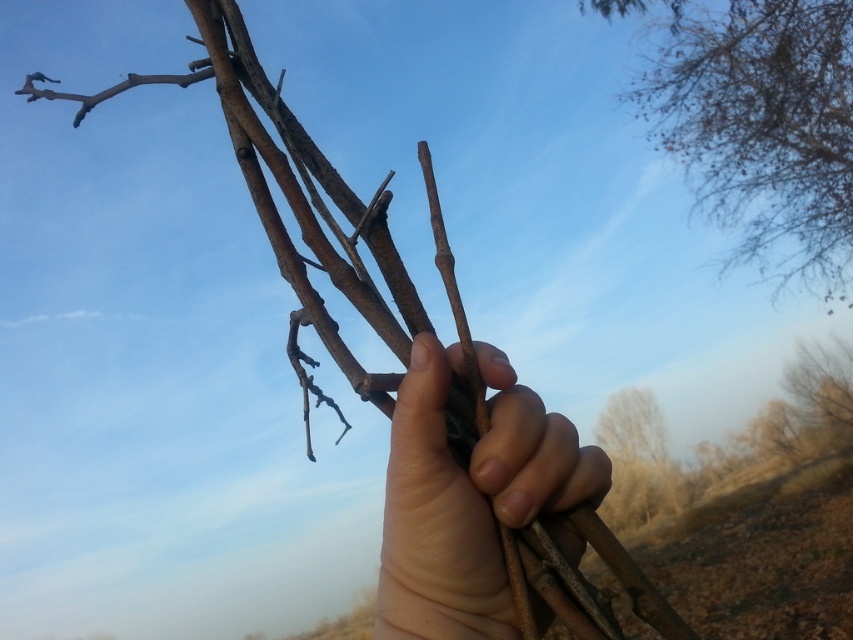
Question: Which point is closer to the camera taking this photo?

Choices:
 (A) (810, 70)
 (B) (611, 513)

Answer: (A)

Question: Where is smooth brown hand at center located in relation to brown rough tree at lower right in the image?

Choices:
 (A) above
 (B) below

Answer: (A)

Question: Which of the following is the farthest from the observer?

Choices:
 (A) (849, 51)
 (B) (606, 438)
 (C) (390, 538)

Answer: (B)

Question: Which object is farther from the camera taking this photo?

Choices:
 (A) brown rough tree at lower right
 (B) smooth brown hand at center
 (C) bare branches at upper right

Answer: (A)

Question: Is bare branches at upper right behind smooth brown hand at center?

Choices:
 (A) yes
 (B) no

Answer: (A)

Question: Is smooth brown hand at center bigger than brown rough tree at lower right?

Choices:
 (A) yes
 (B) no

Answer: (B)